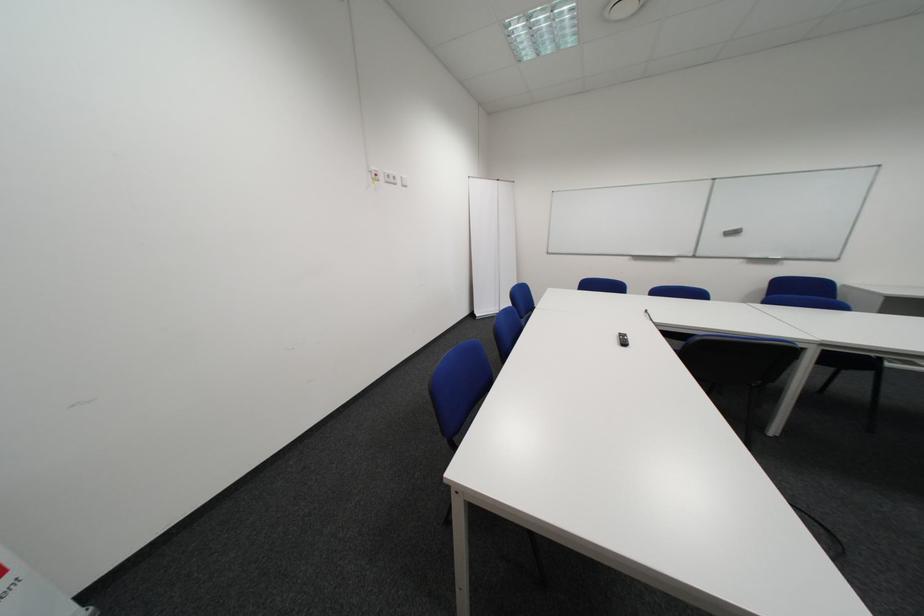
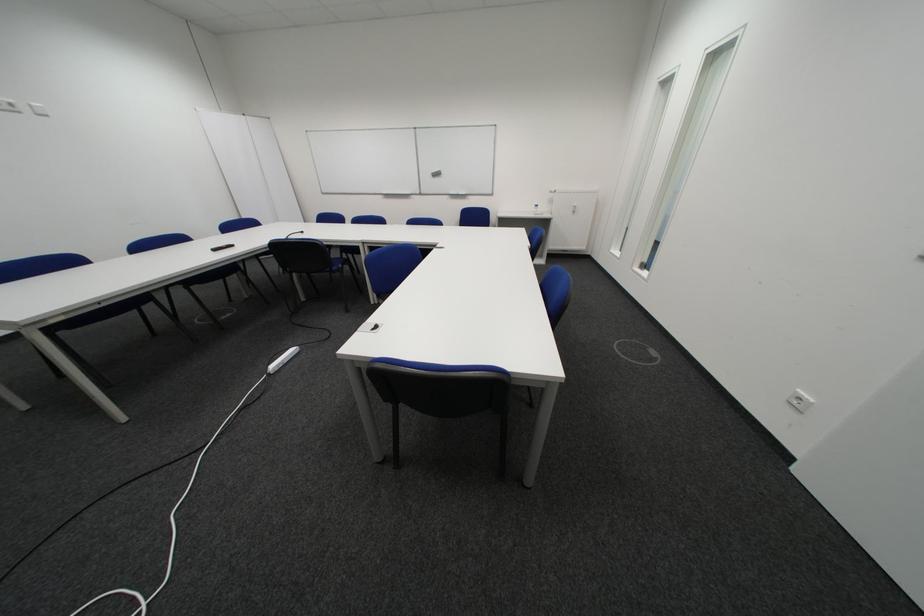
Locate, in the second image, the point that corresponds to point 398,180 in the first image.

(8, 108)